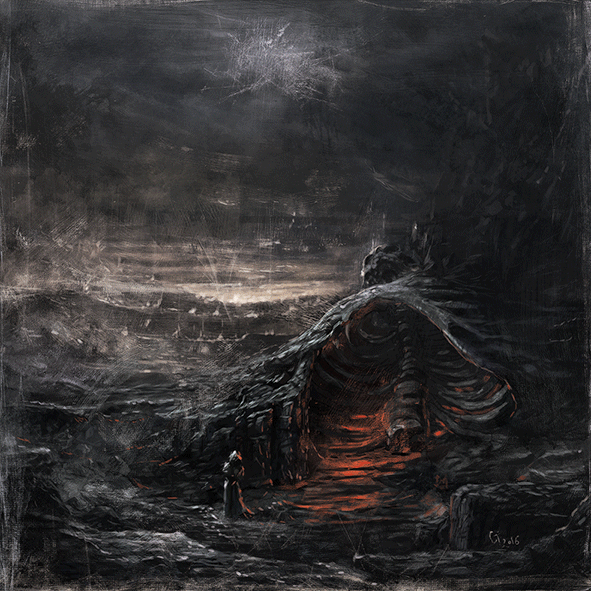
You are a GUI agent. You are given a task and a screenshot of the screen. Output one action in this format:
    pyautogui.click(x=<x>, y=<y>)
    Task: Click on the blanket
    
    Given the screenshot: What is the action you would take?
    pyautogui.click(x=379, y=233), pyautogui.click(x=384, y=272)